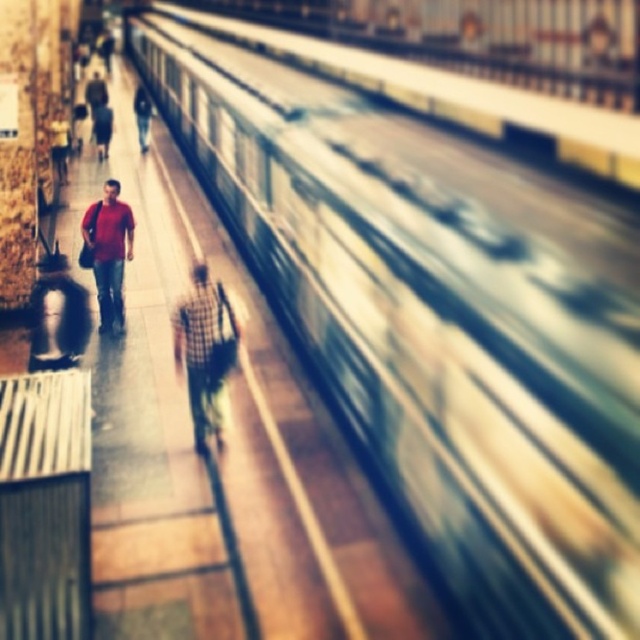
Is matte black jacket at upper left further to the viewer compared to dark blue jeans at center?

That is False.

How much distance is there between matte black jacket at upper left and dark blue jeans at center?

matte black jacket at upper left is 6.31 feet away from dark blue jeans at center.

Identify the location of matte black jacket at upper left. This screenshot has height=640, width=640. (102, 129).

Does green plaid shirt at center lie in front of dark blue jeans at center?

Yes, green plaid shirt at center is closer to the viewer.

Describe the element at coordinates (204, 349) in the screenshot. I see `green plaid shirt at center` at that location.

What do you see at coordinates (204, 349) in the screenshot?
I see `green plaid shirt at center` at bounding box center [204, 349].

This screenshot has height=640, width=640. In order to click on green plaid shirt at center in this screenshot , I will do `click(204, 349)`.

Which of these two, green plaid shirt at center or matte red shirt at center, stands taller?

matte red shirt at center

Does green plaid shirt at center appear on the left side of matte red shirt at center?

No, green plaid shirt at center is not to the left of matte red shirt at center.

The height and width of the screenshot is (640, 640). Find the location of `green plaid shirt at center`. green plaid shirt at center is located at coordinates tap(204, 349).

In order to click on green plaid shirt at center in this screenshot , I will do `click(204, 349)`.